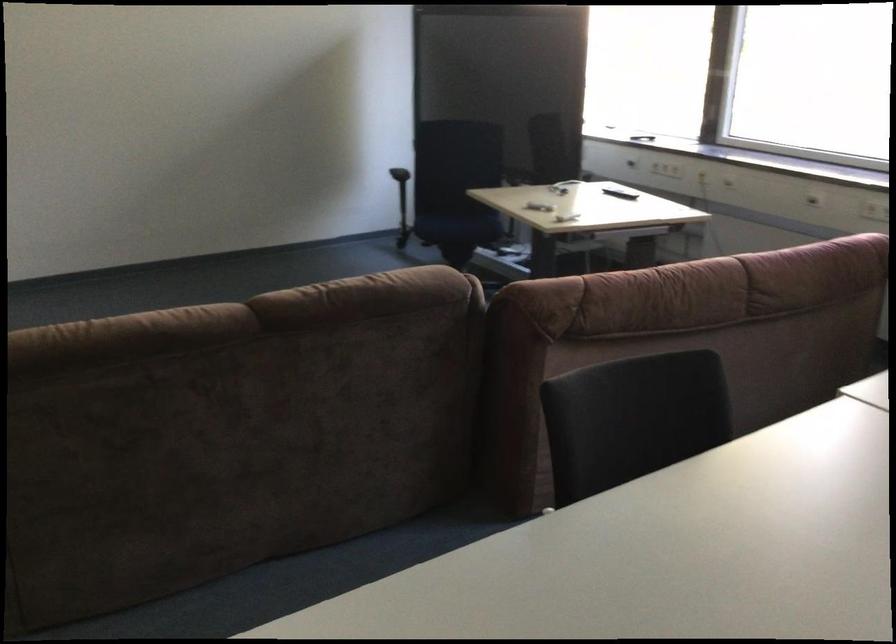
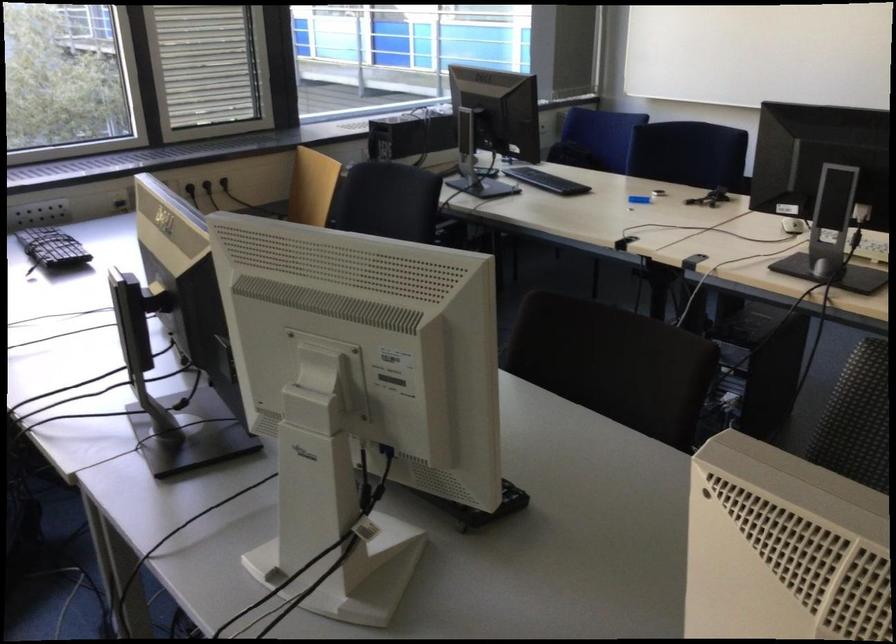
How did the camera likely rotate?

The rotation direction of the camera is right-down.